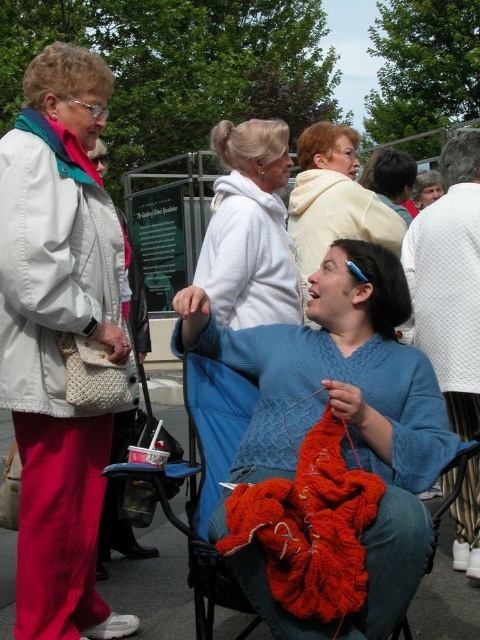
Question: Observing the image, what is the correct spatial positioning of knitted wool sweater at center in reference to white fleece sweater at center?

Choices:
 (A) below
 (B) above

Answer: (A)

Question: Which of the following is the farthest from the observer?

Choices:
 (A) white matte jacket at left
 (B) matte white sweater at center
 (C) knitted wool sweater at center

Answer: (B)

Question: Is white fleece sweater at center positioned before matte white sweater at center?

Choices:
 (A) no
 (B) yes

Answer: (B)

Question: Which of the following is the farthest from the observer?

Choices:
 (A) (28, 618)
 (B) (349, 145)
 (C) (253, 588)

Answer: (B)

Question: Can you confirm if white matte jacket at left is positioned below matte white sweater at center?

Choices:
 (A) no
 (B) yes

Answer: (B)

Question: Estimate the real-world distances between objects in this image. Which object is farther from the matte white sweater at center?

Choices:
 (A) white fleece sweater at center
 (B) knitted wool sweater at center

Answer: (B)